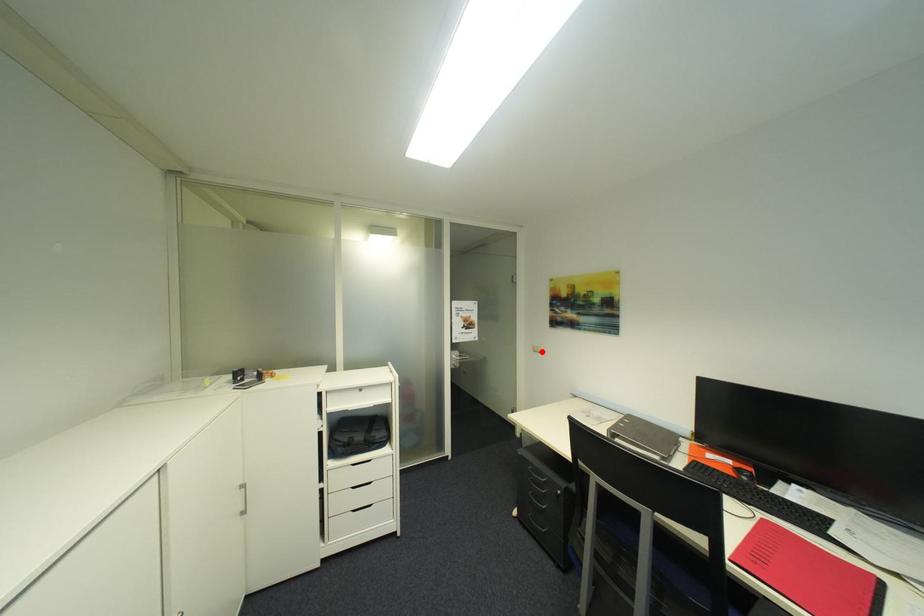
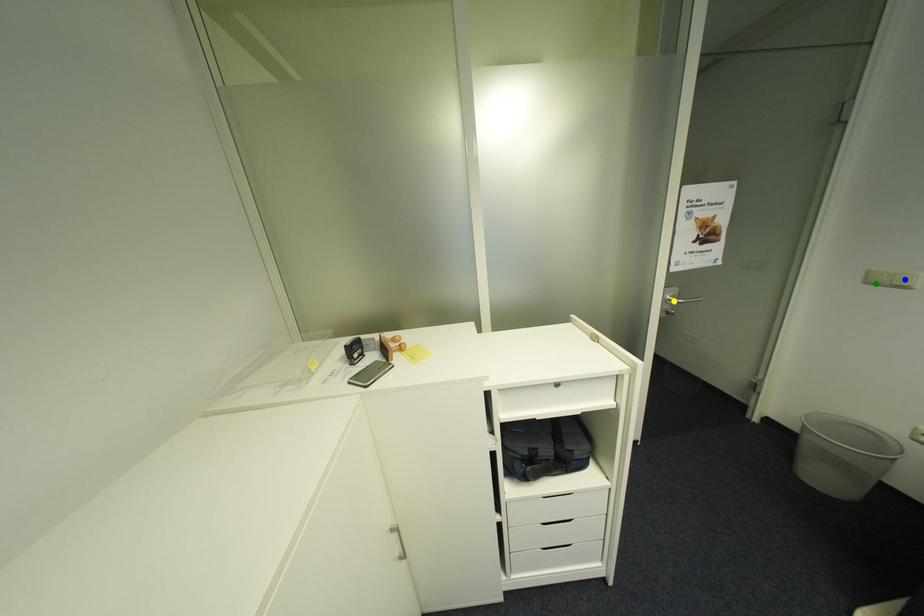
Question: I am providing you with two images of the same scene from different viewpoints. A red point is marked on the first image. You are given multiple points on the second image. Can you choose the point in image 2 that corresponds to the point in image 1?

Choices:
 (A) yellow point
 (B) blue point
 (C) green point

Answer: (C)